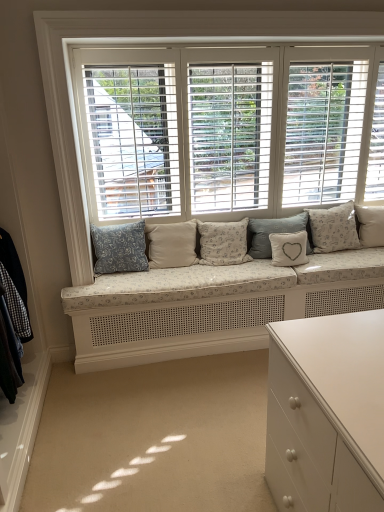
Question: Relative to white textured pillow at center, placed as the third pillow when sorted from right to left, is blue floral fabric pillow at center, the first pillow when ordered from left to right, in front or behind?

Choices:
 (A) behind
 (B) front

Answer: (B)

Question: Does point (102, 267) appear closer or farther from the camera than point (279, 248)?

Choices:
 (A) farther
 (B) closer

Answer: (B)

Question: Which object is positioned closest to the beige fabric pillow at center, placed as the second pillow when sorted from left to right?

Choices:
 (A) white textured pillow at right, which appears as the first pillow when viewed from the right
 (B) white textured cushion at center, the 2th pillow positioned from the right
 (C) fluffy white pillow at center, arranged as the fifth pillow when viewed from the right
 (D) white textured pillow at center, the 5th pillow when ordered from left to right
 (E) blue floral fabric pillow at center, the first pillow when ordered from left to right

Answer: (E)

Question: Which object is the closest to the blue floral fabric pillow at center, which ranks as the 7th pillow in right-to-left order?

Choices:
 (A) white textured pillow at right, which appears as the first pillow when viewed from the right
 (B) white textured cushion at center, the 2th pillow positioned from the right
 (C) fluffy white pillow at center, the third pillow when ordered from left to right
 (D) beige fabric pillow at center, placed as the second pillow when sorted from left to right
 (E) white textured pillow at center, the 5th pillow when ordered from left to right

Answer: (D)